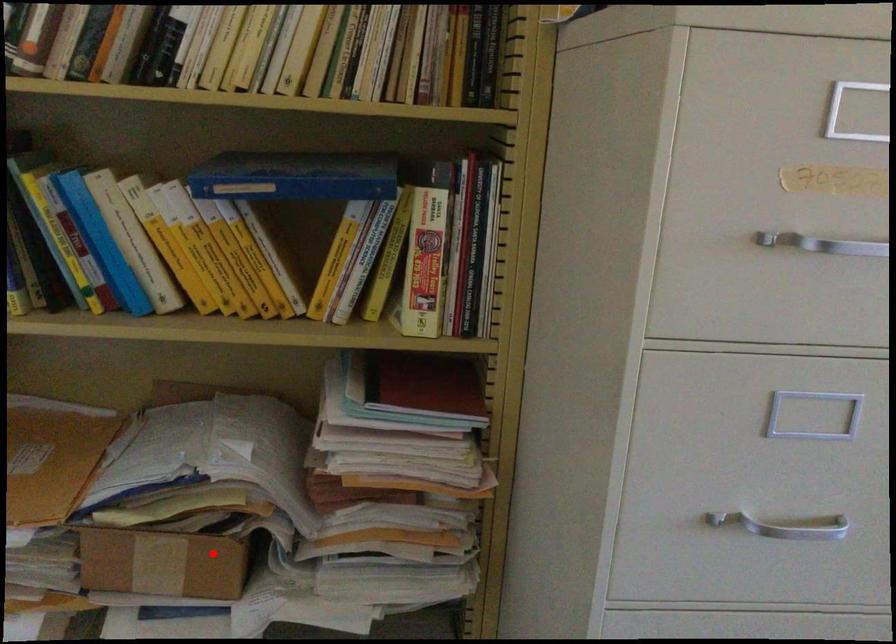
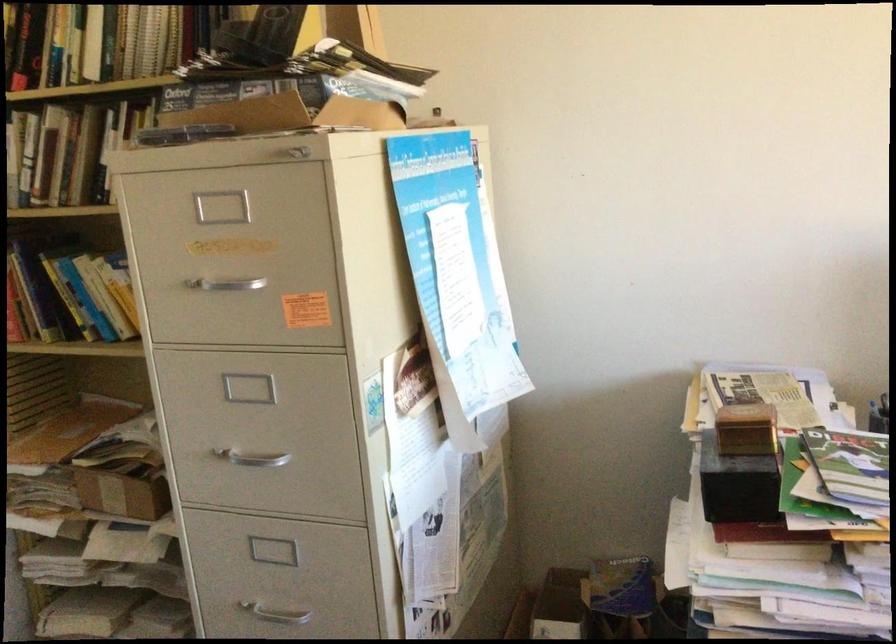
Question: I am providing you with two images of the same scene from different viewpoints. Image1 has a red point marked. In image2, the corresponding 3D location appears at what relative position? Reply with the corresponding letter.

Choices:
 (A) Closer
 (B) Farther

Answer: (B)